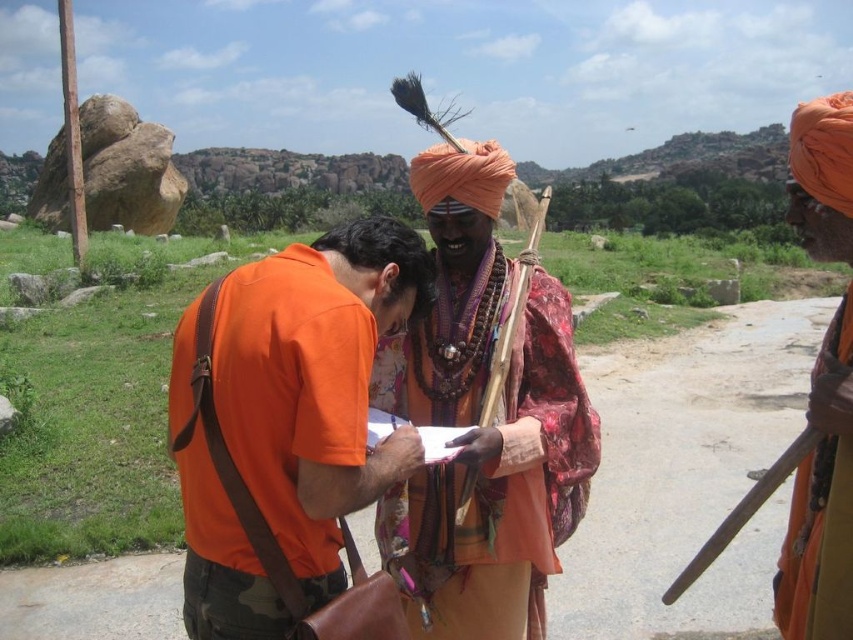
You are a photographer trying to capture both the orange cotton shirt at center and the orange turban at right in the same frame. Based on their sizes, which object should you focus on first to ensure both fit in the photo?

The orange cotton shirt at center is smaller than the orange turban at right. To ensure both fit in the photo, focus on positioning the orange turban at right first since it takes up more space, then adjust to include the smaller orange cotton shirt at center.

You are a photographer trying to capture a portrait of both the textured silk robe at center and the orange turban at right. To ensure both are in the frame, should you adjust your camera to focus more to the left or the right side of the scene?

The textured silk robe at center is to the left of the orange turban at right, so you should focus more to the right side of the scene to include both in the frame.

You are a photographer planning to capture a portrait of the two men in the scene. You need to ensure that both the orange cotton shirt at center and the orange turban at right are clearly visible in the frame. Given their sizes, which object should you focus on to ensure both are in focus?

The orange cotton shirt at center has a smaller width than the orange turban at right. To ensure both are in focus, focus on the orange cotton shirt at center since it is closer to the camera, allowing the turban to remain in the depth of field.